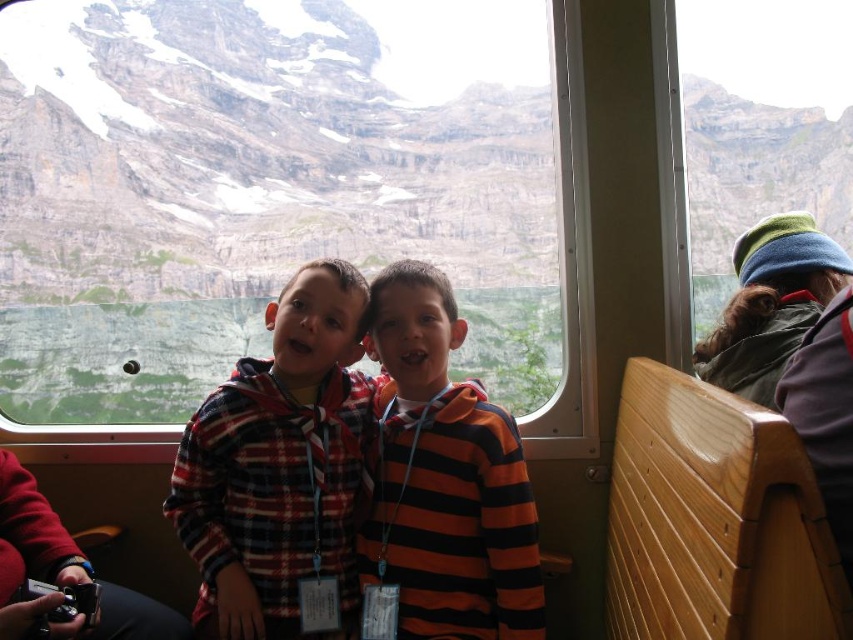
You are a photographer trying to capture a candid shot of both the plaid fabric shirt at center and the orange striped hoodie at center. Since you can only focus on one subject at a time, which one should you aim for first to ensure the other is still in frame?

The plaid fabric shirt at center is to the left of orange striped hoodie at center, so you should focus on the plaid fabric shirt at center first. This way, after capturing it, the orange striped hoodie at center will remain in the frame to the right.

Based on the photo, you are a photographer trying to capture both the plaid fabric shirt at center and the orange striped hoodie at center in a single shot. Given their sizes, which one should you focus on to ensure both fit in the frame without cropping?

The plaid fabric shirt at center occupies less space than the orange striped hoodie at center, so you should focus on the orange striped hoodie at center to ensure both fit in the frame without cropping.